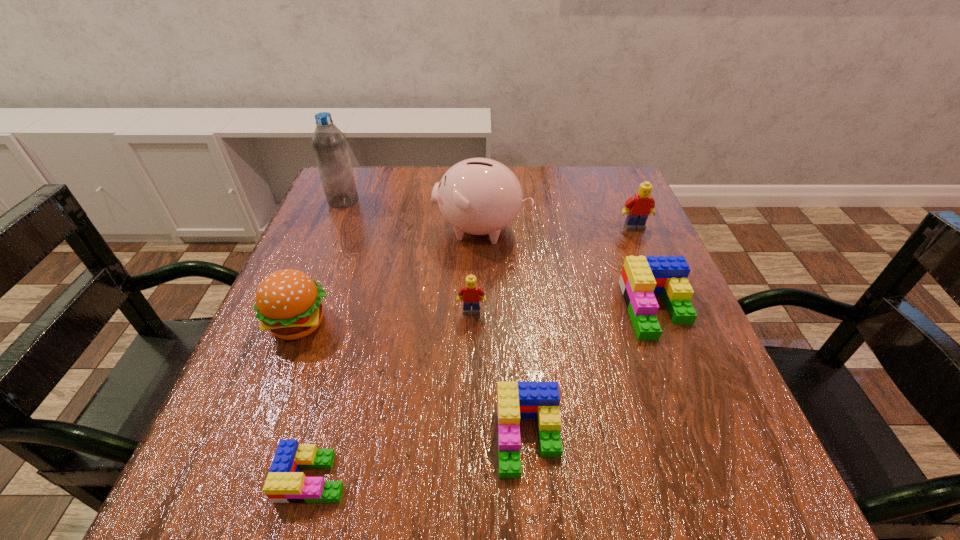
You are a GUI agent. You are given a task and a screenshot of the screen. Output one action in this format:
    pyautogui.click(x=<x>, y=<y>)
    Task: Click on the empty location between the biggest green Lego and the leftmost Lego
    This screenshot has height=540, width=960.
    Given the screenshot: What is the action you would take?
    [485, 393]

Identify the location of free point between the smaller yellow Lego and the water bottle. This screenshot has height=540, width=960. (407, 255).

Identify the location of free space between the fourth tallest Lego and the leftmost Lego. The width and height of the screenshot is (960, 540). (420, 457).

At what (x,y) coordinates should I click in order to perform the action: click on free space between the sixth tallest object and the hamburger. Please return your answer as a coordinate pair (x, y). Looking at the image, I should click on (478, 316).

Where is `unoccupied area between the leftmost green Lego and the blue water bottle`? The image size is (960, 540). unoccupied area between the leftmost green Lego and the blue water bottle is located at coordinates (328, 339).

Locate which object is the closest to the right yellow Lego. Please provide its 2D coordinates. Your answer should be formatted as a tuple, i.e. [(x, y)], where the tuple contains the x and y coordinates of a point satisfying the conditions above.

[(642, 278)]

The height and width of the screenshot is (540, 960). What are the coordinates of `object that is the sixth closest to the leftmost Lego` in the screenshot? It's located at (329, 144).

Select which Lego appears as the closest to the hamburger. Please provide its 2D coordinates. Your answer should be formatted as a tuple, i.e. [(x, y)], where the tuple contains the x and y coordinates of a point satisfying the conditions above.

[(285, 484)]

Identify which Lego is the second closest to the leftmost green Lego. Please provide its 2D coordinates. Your answer should be formatted as a tuple, i.e. [(x, y)], where the tuple contains the x and y coordinates of a point satisfying the conditions above.

[(470, 294)]

This screenshot has height=540, width=960. I want to click on the third closest green Lego to the left yellow Lego, so click(285, 484).